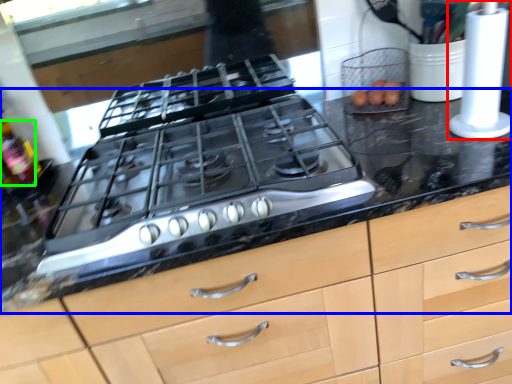
Question: Which object is the closest to the kitchen appliance (highlighted by a red box)? Choose among these: countertop (highlighted by a blue box) or bottle (highlighted by a green box).

Choices:
 (A) countertop
 (B) bottle

Answer: (A)